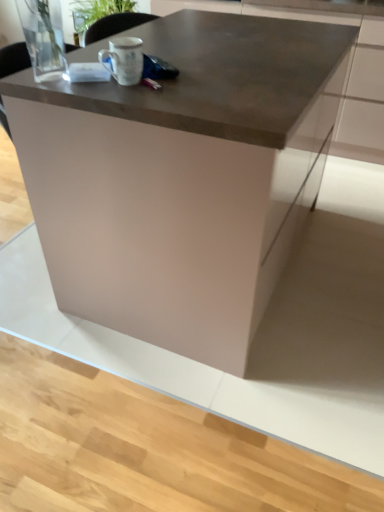
Where is `vacant area in front of matte brown table at center`? Image resolution: width=384 pixels, height=512 pixels. vacant area in front of matte brown table at center is located at coordinates point(202,403).